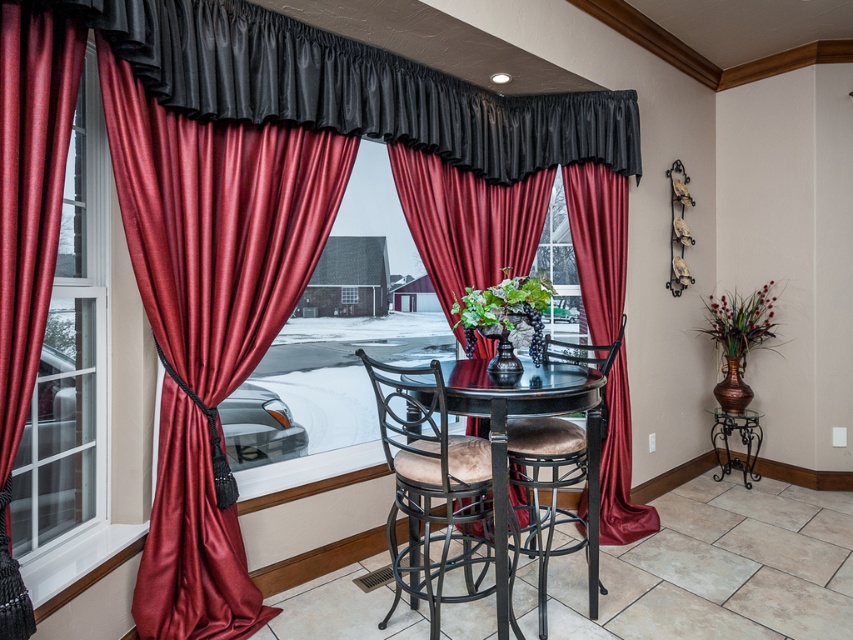
Question: Where is satin red curtains at left located in relation to velvet tan chair at center in the image?

Choices:
 (A) below
 (B) above

Answer: (B)

Question: Is satin red curtain at center positioned at the back of velvet tan chair at center?

Choices:
 (A) no
 (B) yes

Answer: (B)

Question: Which object is positioned farthest from the satin red curtain at center?

Choices:
 (A) satin curtain at left
 (B) velvet tan chair at center
 (C) satin red curtains at left

Answer: (A)

Question: Which point appears closest to the camera in this image?

Choices:
 (A) (440, 538)
 (B) (126, 182)

Answer: (B)

Question: Estimate the real-world distances between objects in this image. Which object is farther from the velvet tan chair at center?

Choices:
 (A) satin curtain at left
 (B) satin red curtains at left

Answer: (A)

Question: Is satin red curtains at left smaller than velvet tan chair at center?

Choices:
 (A) no
 (B) yes

Answer: (A)